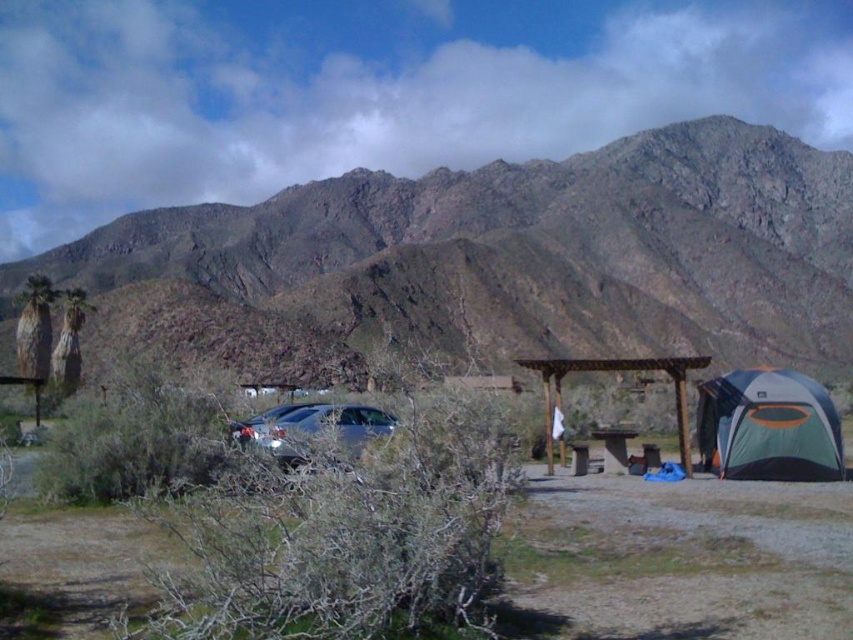
You are a hiker carrying a heavy backpack and need to rest. You see the green and gray fabric tent at lower right and the wooden picnic table at center. Which location is closer to you if you are standing exactly in the middle of the path between them?

Both the green and gray fabric tent at lower right and the wooden picnic table at center are equidistant from your current position since you are standing exactly in the middle of the path between them.

You are a hiker who wants to take a photo of the rugged rock mountain range at upper center and the green and gray fabric tent at lower right. Which object should you focus on first if you want to capture both in one frame without changing your camera settings?

The rugged rock mountain range at upper center is taller than the green and gray fabric tent at lower right, so you should focus on the rugged rock mountain range at upper center first to ensure it is in sharp focus before the tent.